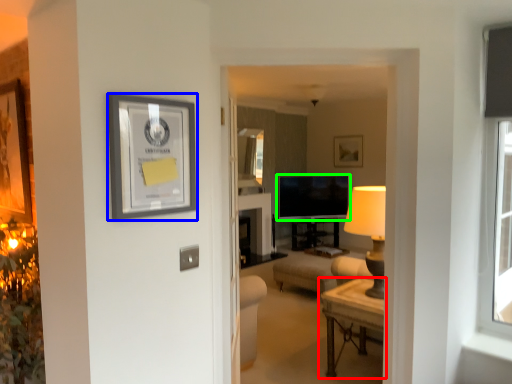
Question: Which object is positioned closest to table (highlighted by a red box)? Select from picture frame (highlighted by a blue box) and television (highlighted by a green box).

Choices:
 (A) picture frame
 (B) television

Answer: (A)